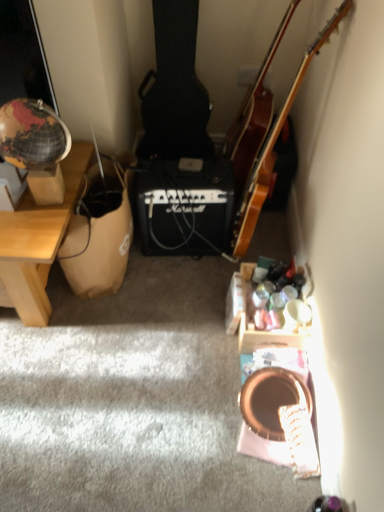
At what (x,y) coordinates should I click in order to perform the action: click on vacant space in front of brown paper bag at left. Please return your answer as a coordinate pair (x, y). The image size is (384, 512). Looking at the image, I should click on (115, 335).